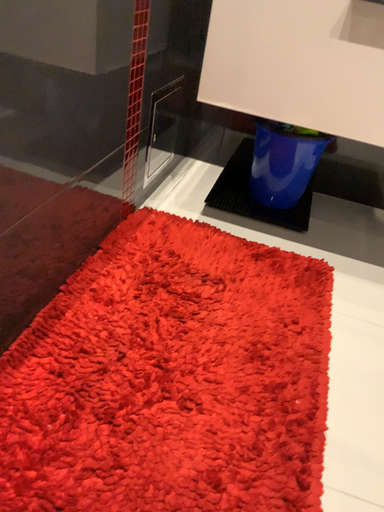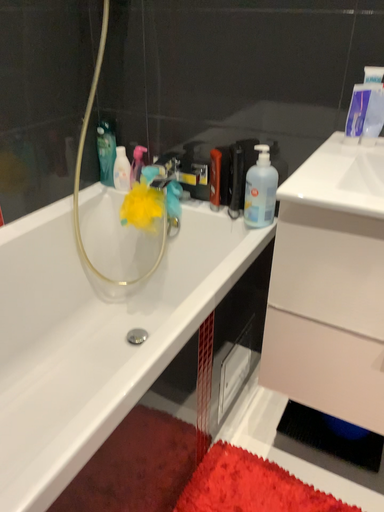
Question: Which way did the camera rotate in the video?

Choices:
 (A) rotated upward
 (B) rotated downward

Answer: (A)